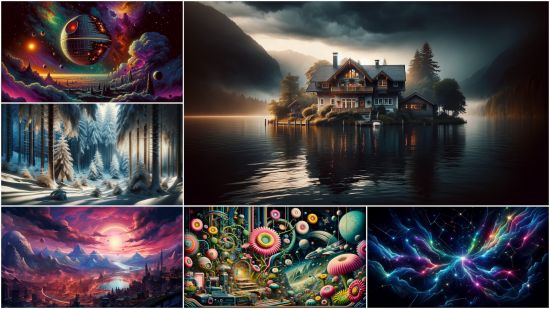
Locate an element on the screen. chimney is located at coordinates (333, 63), (375, 64).